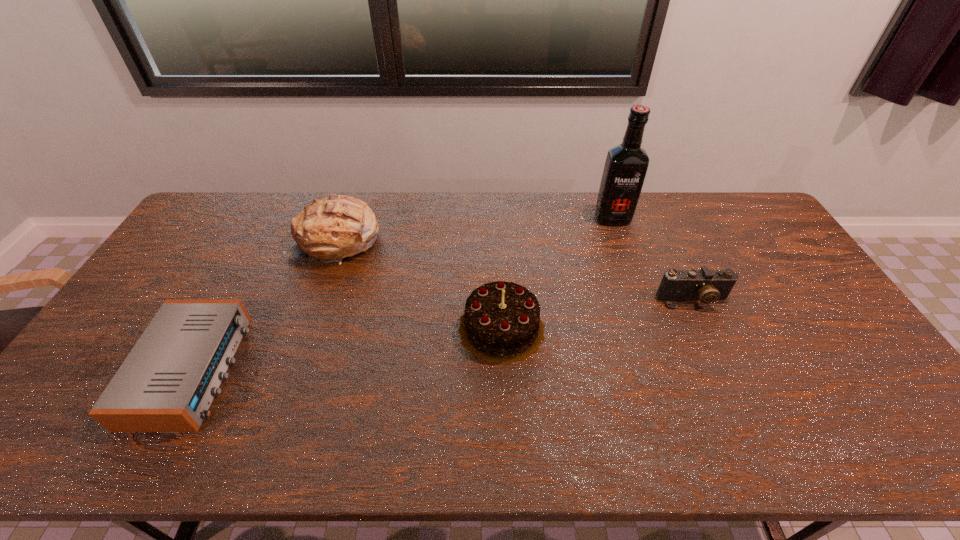
Identify the location of liquor. (x=626, y=165).

You are a GUI agent. You are given a task and a screenshot of the screen. Output one action in this format:
    pyautogui.click(x=<x>, y=<y>)
    Task: Click on the bread
    This screenshot has width=960, height=540.
    Given the screenshot: What is the action you would take?
    pyautogui.click(x=339, y=226)

Where is `the third object from right to left`? The width and height of the screenshot is (960, 540). the third object from right to left is located at coordinates (501, 323).

Locate an element on the screen. The height and width of the screenshot is (540, 960). the fourth tallest object is located at coordinates (708, 286).

What are the coordinates of `the shortest object` in the screenshot? It's located at (167, 383).

Find the location of a particular element. vacant point located 0.240m on the front-facing side of the tallest object is located at coordinates (633, 275).

This screenshot has height=540, width=960. I want to click on vacant position located on the right of the bread, so click(404, 240).

Locate an element on the screen. The width and height of the screenshot is (960, 540). free space located on the left of the birthday cake is located at coordinates (315, 328).

The width and height of the screenshot is (960, 540). In order to click on vacant position located 0.280m on the front-facing side of the camera in this screenshot , I will do `click(738, 397)`.

Where is `vacant space situated on the front panel of the shortest object`? The height and width of the screenshot is (540, 960). vacant space situated on the front panel of the shortest object is located at coordinates (343, 370).